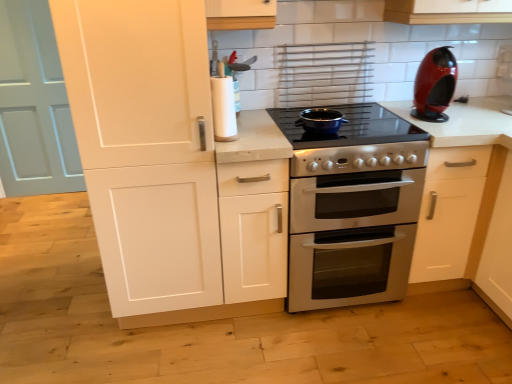
In order to click on vacant space in front of glossy plastic coffee machine at upper right in this screenshot , I will do `click(456, 123)`.